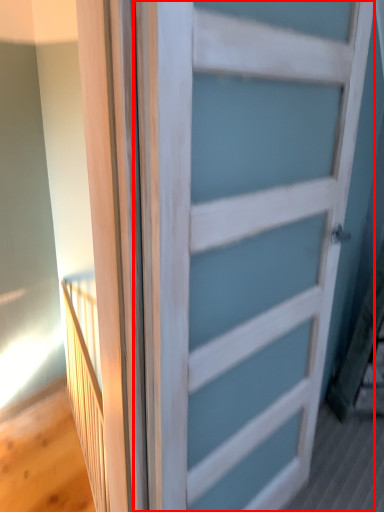
Question: Where is door (annotated by the red box) located in relation to elevator in the image?

Choices:
 (A) right
 (B) left

Answer: (A)